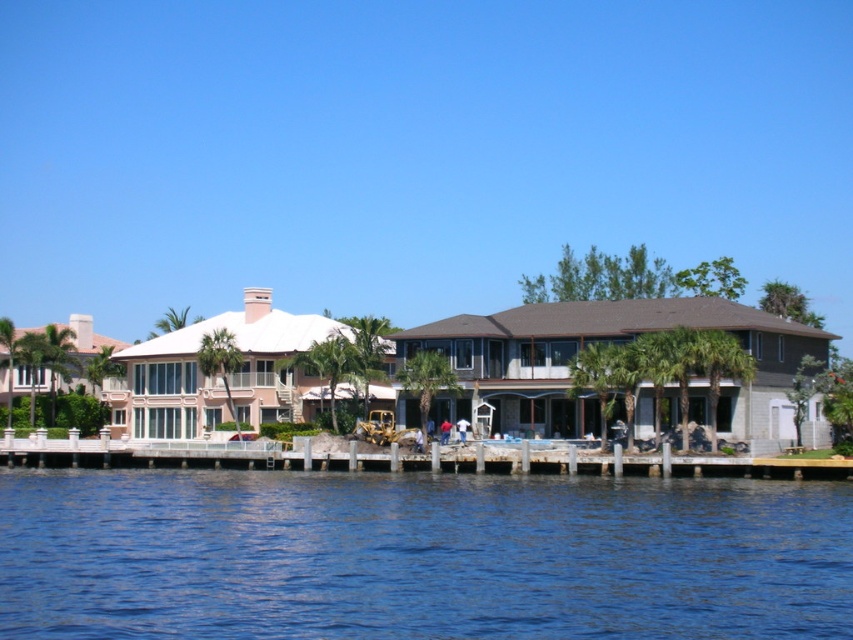
Question: Is blue water at lower center further to the viewer compared to white concrete dock at lower center?

Choices:
 (A) yes
 (B) no

Answer: (B)

Question: Among these objects, which one is farthest from the camera?

Choices:
 (A) blue water at lower center
 (B) white concrete dock at lower center

Answer: (B)

Question: Does blue water at lower center have a smaller size compared to white concrete dock at lower center?

Choices:
 (A) yes
 (B) no

Answer: (B)

Question: Can you confirm if blue water at lower center is bigger than white concrete dock at lower center?

Choices:
 (A) no
 (B) yes

Answer: (B)